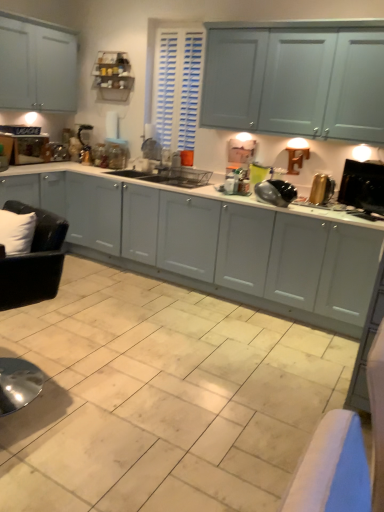
Question: Can you confirm if black glossy pan at center, which ranks as the third appliance in right-to-left order, is wider than black plastic monitor at right, positioned as the third appliance in left-to-right order?

Choices:
 (A) yes
 (B) no

Answer: (A)

Question: Is black glossy pan at center, which is counted as the 1th appliance, starting from the left, turned away from black plastic monitor at right, positioned as the third appliance in left-to-right order?

Choices:
 (A) no
 (B) yes

Answer: (A)

Question: Are black glossy pan at center, which ranks as the third appliance in right-to-left order, and black plastic monitor at right, which is counted as the first appliance, starting from the right, located far from each other?

Choices:
 (A) no
 (B) yes

Answer: (A)

Question: From the image's perspective, does black glossy pan at center, which is counted as the 1th appliance, starting from the left, appear higher than black plastic monitor at right, which is counted as the first appliance, starting from the right?

Choices:
 (A) yes
 (B) no

Answer: (A)

Question: Considering the relative sizes of black glossy pan at center, which is counted as the 1th appliance, starting from the left, and black plastic monitor at right, positioned as the third appliance in left-to-right order, in the image provided, is black glossy pan at center, which is counted as the 1th appliance, starting from the left, shorter than black plastic monitor at right, positioned as the third appliance in left-to-right order,?

Choices:
 (A) yes
 (B) no

Answer: (A)

Question: Considering the positions of gold metallic toaster at right, the second appliance when ordered from right to left, and black glossy pan at center, which is counted as the 1th appliance, starting from the left, in the image, is gold metallic toaster at right, the second appliance when ordered from right to left, taller or shorter than black glossy pan at center, which is counted as the 1th appliance, starting from the left,?

Choices:
 (A) tall
 (B) short

Answer: (A)

Question: From the image's perspective, relative to black glossy pan at center, which is counted as the 1th appliance, starting from the left, is gold metallic toaster at right, acting as the second appliance starting from the left, above or below?

Choices:
 (A) below
 (B) above

Answer: (B)

Question: Considering the positions of gold metallic toaster at right, acting as the second appliance starting from the left, and black glossy pan at center, which ranks as the third appliance in right-to-left order, in the image, is gold metallic toaster at right, acting as the second appliance starting from the left, bigger or smaller than black glossy pan at center, which ranks as the third appliance in right-to-left order,?

Choices:
 (A) big
 (B) small

Answer: (B)

Question: Does point (329, 181) appear closer or farther from the camera than point (263, 198)?

Choices:
 (A) closer
 (B) farther

Answer: (B)

Question: From their relative heights in the image, would you say black plastic monitor at right, positioned as the third appliance in left-to-right order, is taller or shorter than beige ceramic tile at center?

Choices:
 (A) short
 (B) tall

Answer: (B)

Question: Would you say black plastic monitor at right, positioned as the third appliance in left-to-right order, is inside or outside beige ceramic tile at center?

Choices:
 (A) inside
 (B) outside

Answer: (B)

Question: Considering the positions of point (354, 167) and point (203, 380), is point (354, 167) closer or farther from the camera than point (203, 380)?

Choices:
 (A) farther
 (B) closer

Answer: (A)

Question: Considering the positions of black plastic monitor at right, positioned as the third appliance in left-to-right order, and beige ceramic tile at center in the image, is black plastic monitor at right, positioned as the third appliance in left-to-right order, bigger or smaller than beige ceramic tile at center?

Choices:
 (A) big
 (B) small

Answer: (B)

Question: Considering the positions of point (291, 221) and point (253, 437), is point (291, 221) closer or farther from the camera than point (253, 437)?

Choices:
 (A) closer
 (B) farther

Answer: (B)

Question: In terms of height, does matte white cabinets at center look taller or shorter compared to beige ceramic tile at center?

Choices:
 (A) short
 (B) tall

Answer: (B)